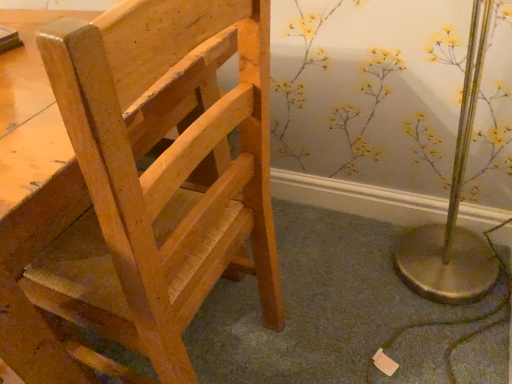
The width and height of the screenshot is (512, 384). Describe the element at coordinates (143, 189) in the screenshot. I see `natural wood chair at center` at that location.

Where is `natural wood chair at center`? natural wood chair at center is located at coordinates (143, 189).

I want to click on natural wood chair at center, so click(143, 189).